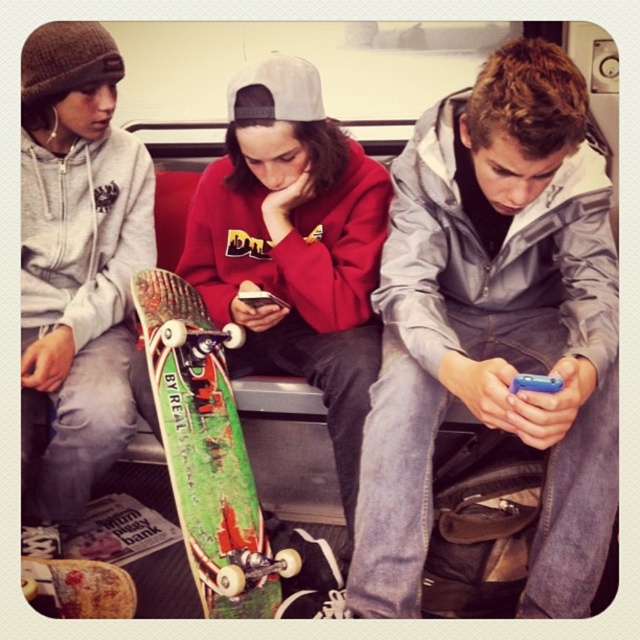
Question: Does green painted wood skateboard at center have a larger size compared to green wooden skateboard at lower left?

Choices:
 (A) yes
 (B) no

Answer: (A)

Question: Can you confirm if green painted wood skateboard at center is wider than green wooden skateboard at lower left?

Choices:
 (A) yes
 (B) no

Answer: (A)

Question: Among these objects, which one is nearest to the camera?

Choices:
 (A) green painted skateboard at center
 (B) green painted wood skateboard at center
 (C) silver metallic jacket at center
 (D) green wooden skateboard at lower left

Answer: (C)

Question: Which is farther from the green painted skateboard at center?

Choices:
 (A) silver metallic jacket at center
 (B) green wooden skateboard at lower left

Answer: (B)

Question: Which object is positioned farthest from the silver metallic jacket at center?

Choices:
 (A) green painted skateboard at center
 (B) green painted wood skateboard at center

Answer: (B)

Question: Is green painted skateboard at center to the left of green wooden skateboard at lower left from the viewer's perspective?

Choices:
 (A) yes
 (B) no

Answer: (B)